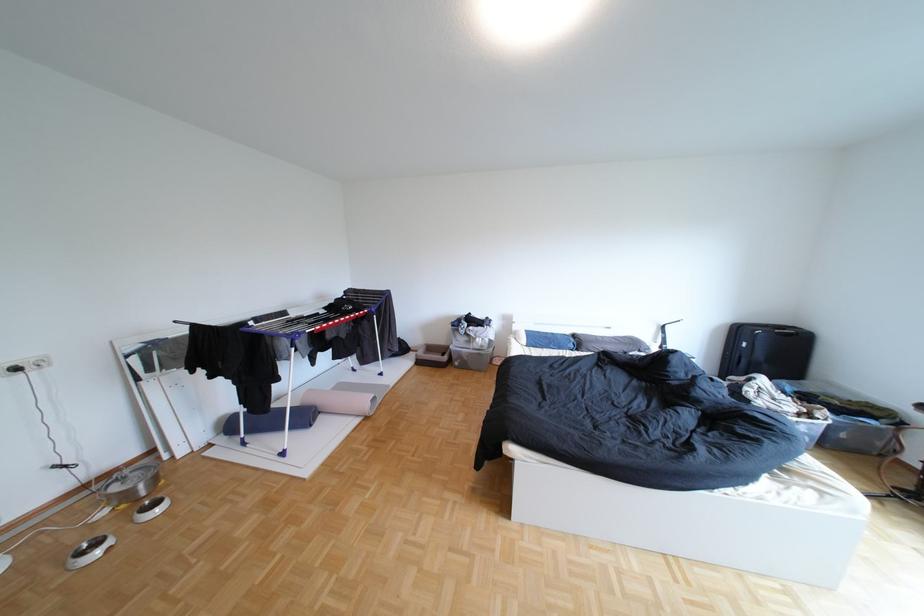
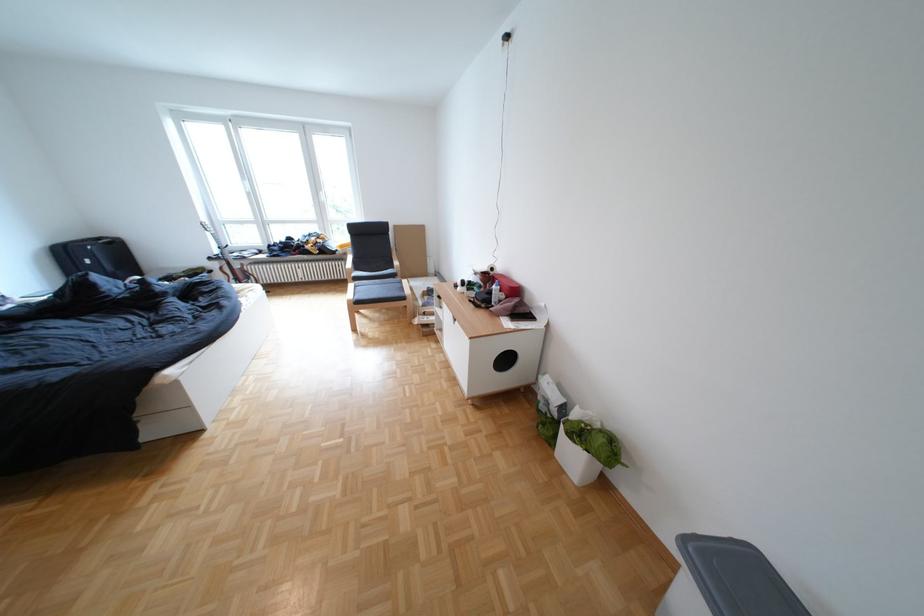
Find the pixel in the second image that matches [806,334] in the first image.

(126, 244)